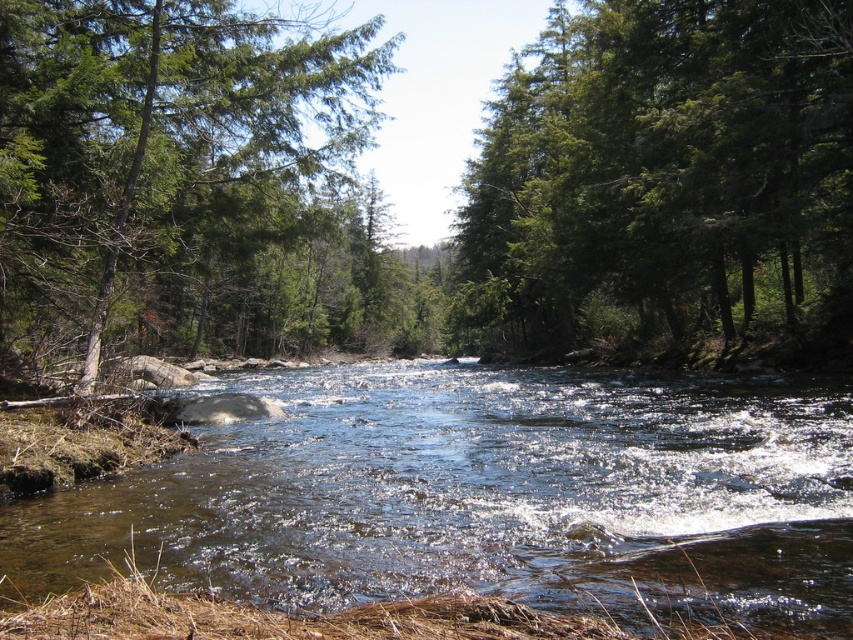
Does clear water at center have a lesser width compared to green matte tree at upper right?

Indeed, clear water at center has a lesser width compared to green matte tree at upper right.

Is clear water at center wider than green matte tree at upper right?

No, clear water at center is not wider than green matte tree at upper right.

Locate an element on the screen. The width and height of the screenshot is (853, 640). clear water at center is located at coordinates (486, 496).

Is green leafy forest at center to the right of clear water at center from the viewer's perspective?

Incorrect, green leafy forest at center is not on the right side of clear water at center.

Does green leafy forest at center have a larger size compared to clear water at center?

Indeed, green leafy forest at center has a larger size compared to clear water at center.

The image size is (853, 640). I want to click on green leafy forest at center, so click(459, 188).

Between point (51, 308) and point (512, 257), which one is positioned in front?

Positioned in front is point (51, 308).

In the scene shown: Between green matte tree at left and green matte tree at upper right, which one appears on the right side from the viewer's perspective?

From the viewer's perspective, green matte tree at upper right appears more on the right side.

Does point (190, 339) come in front of point (740, 74)?

No, it is behind (740, 74).

What are the coordinates of `green matte tree at left` in the screenshot? It's located at (190, 189).